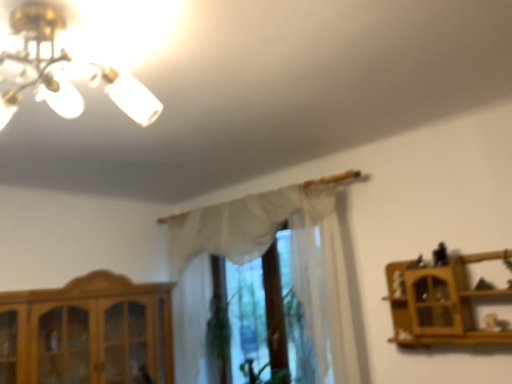
Question: In terms of height, does wooden shelf at right look taller or shorter compared to white sheer curtain at center?

Choices:
 (A) tall
 (B) short

Answer: (B)

Question: From the image's perspective, relative to white sheer curtain at center, is wooden shelf at right above or below?

Choices:
 (A) below
 (B) above

Answer: (A)

Question: Based on their relative distances, which object is nearer to the white sheer curtain at center?

Choices:
 (A) wooden cabinet at lower left
 (B) black plastic toy at upper right
 (C) wooden shelf at right

Answer: (A)

Question: Which object is positioned closest to the wooden shelf at right?

Choices:
 (A) white sheer curtain at center
 (B) wooden cabinet at lower left
 (C) black plastic toy at upper right

Answer: (C)